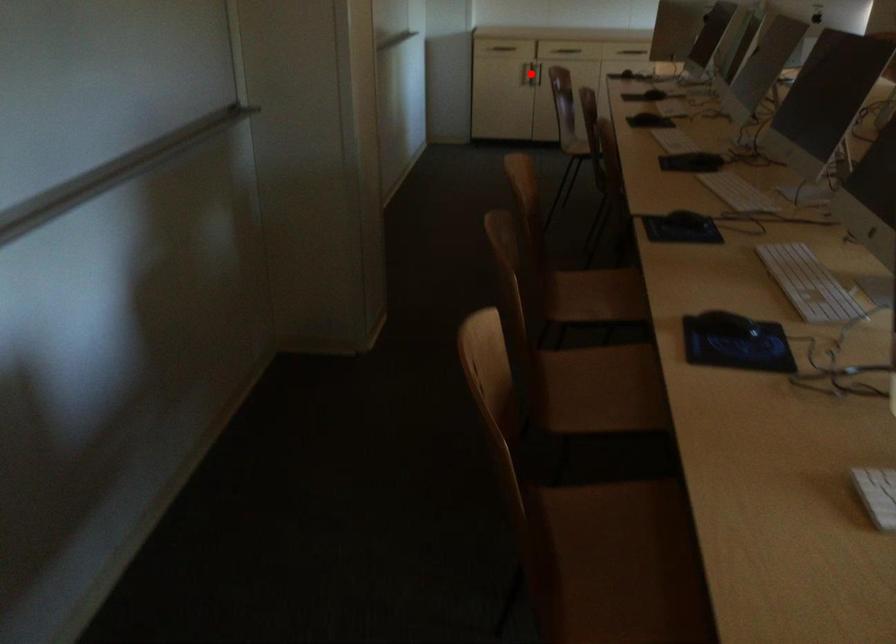
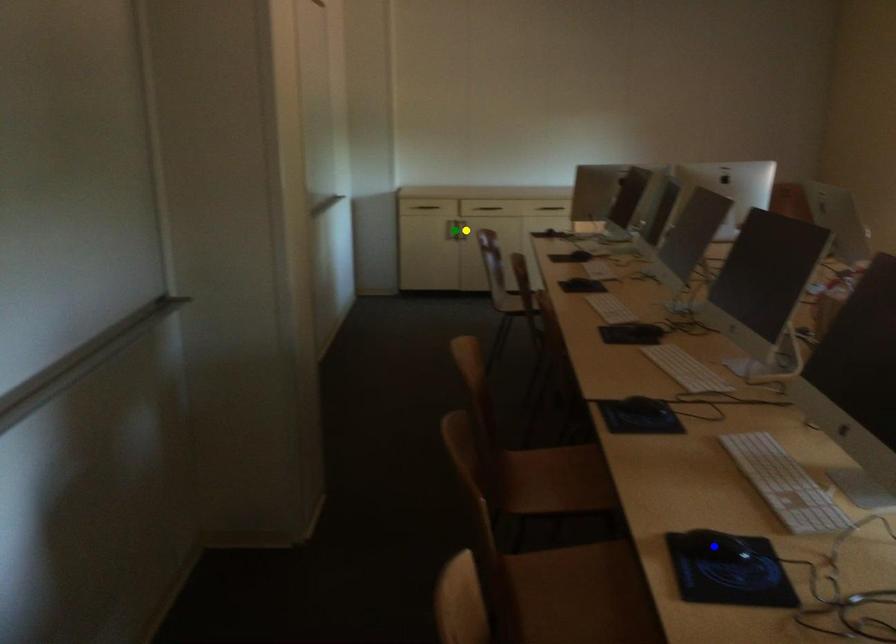
Question: I am providing you with two images of the same scene from different viewpoints. A red point is marked on the first image. You are given multiple points on the second image. Which mark in image 2 goes with the point in image 1?

Choices:
 (A) yellow point
 (B) green point
 (C) blue point

Answer: (B)